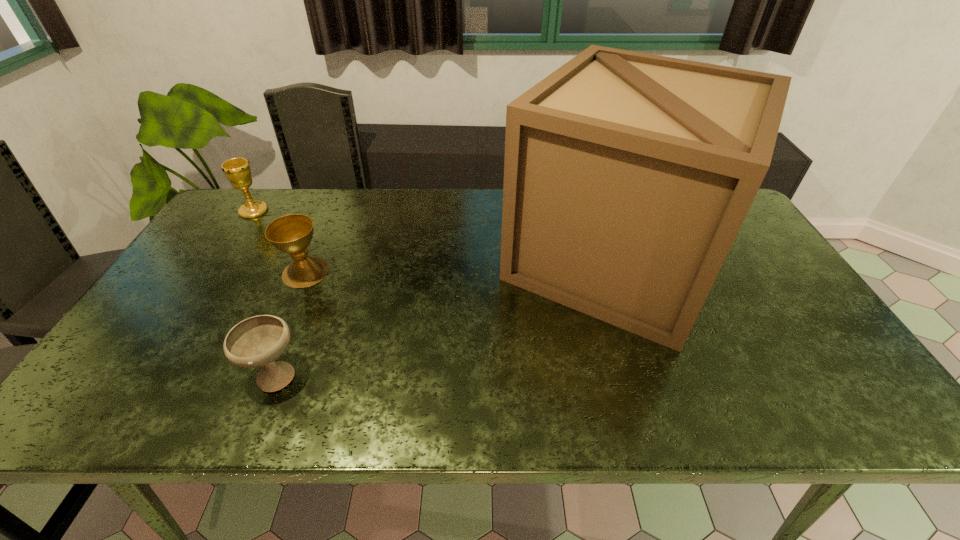
Image resolution: width=960 pixels, height=540 pixels. In order to click on vacant region located on the right of the shortest chalice in this screenshot , I will do `click(374, 374)`.

The image size is (960, 540). Identify the location of box situated at the far edge. (627, 176).

Find the location of a particular element. The image size is (960, 540). chalice situated at the far edge is located at coordinates (237, 170).

Where is `object situated at the near edge`? object situated at the near edge is located at coordinates (257, 341).

Locate an element on the screen. The width and height of the screenshot is (960, 540). object that is at the left edge is located at coordinates (237, 170).

The width and height of the screenshot is (960, 540). Find the location of `object that is at the right edge`. object that is at the right edge is located at coordinates (627, 176).

The image size is (960, 540). I want to click on object that is positioned at the far left corner, so click(x=237, y=170).

The width and height of the screenshot is (960, 540). I want to click on object that is at the far right corner, so click(627, 176).

Locate an element on the screen. The image size is (960, 540). vacant space at the far edge of the desktop is located at coordinates (468, 196).

You are a GUI agent. You are given a task and a screenshot of the screen. Output one action in this format:
    pyautogui.click(x=<x>, y=<y>)
    Task: Click on the vacant space at the left edge of the desktop
    The image size is (960, 540).
    Given the screenshot: What is the action you would take?
    coord(230,238)